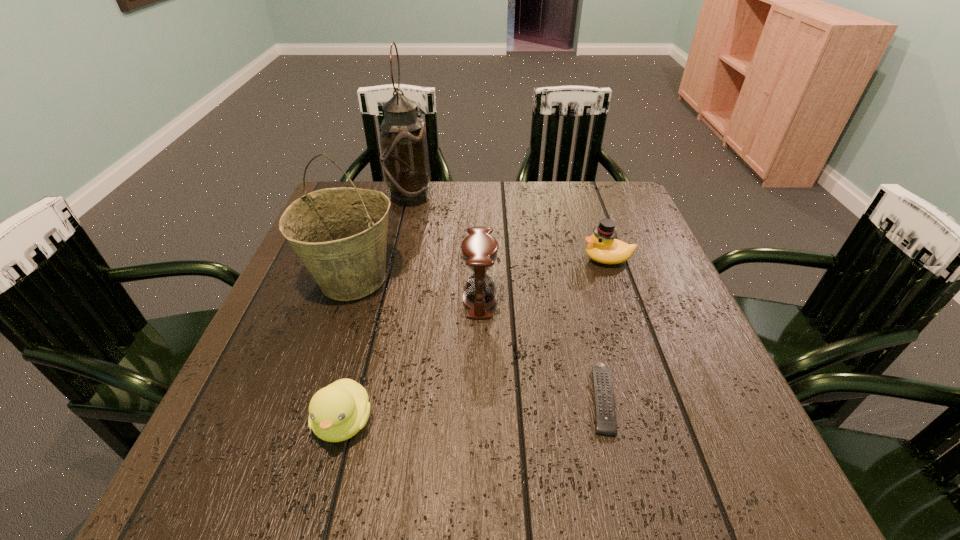
You are a GUI agent. You are given a task and a screenshot of the screen. Output one action in this format:
    pyautogui.click(x=<x>, y=<y>)
    Task: Click on the object at the right edge
    This screenshot has width=960, height=540.
    Given the screenshot: What is the action you would take?
    pyautogui.click(x=603, y=247)

At what (x,y) coordinates should I click in order to perform the action: click on free space at the far edge of the desktop. Please return your answer as a coordinate pair (x, y). The width and height of the screenshot is (960, 540). Looking at the image, I should click on (457, 193).

Locate an element on the screen. The width and height of the screenshot is (960, 540). vacant space at the near edge is located at coordinates (584, 472).

Image resolution: width=960 pixels, height=540 pixels. I want to click on free space at the left edge of the desktop, so click(308, 300).

At what (x,y) coordinates should I click in order to perform the action: click on vacant space at the right edge of the desktop. Please return your answer as a coordinate pair (x, y). Looking at the image, I should click on (x=621, y=231).

Where is `unoccupied area between the hourglass and the oil lamp`? This screenshot has height=540, width=960. unoccupied area between the hourglass and the oil lamp is located at coordinates (444, 248).

Find the location of a particular element. Image resolution: width=960 pixels, height=540 pixels. vacant point located between the fifth object from left to right and the duckling is located at coordinates (472, 410).

The height and width of the screenshot is (540, 960). I want to click on free point between the duck and the fourth object from left to right, so click(x=544, y=279).

This screenshot has height=540, width=960. In order to click on empty space that is in between the duckling and the oil lamp in this screenshot , I will do `click(376, 309)`.

At what (x,y) coordinates should I click in order to perform the action: click on vacant space that is in between the wine bucket and the hourglass. Please return your answer as a coordinate pair (x, y). This screenshot has width=960, height=540. Looking at the image, I should click on (416, 289).